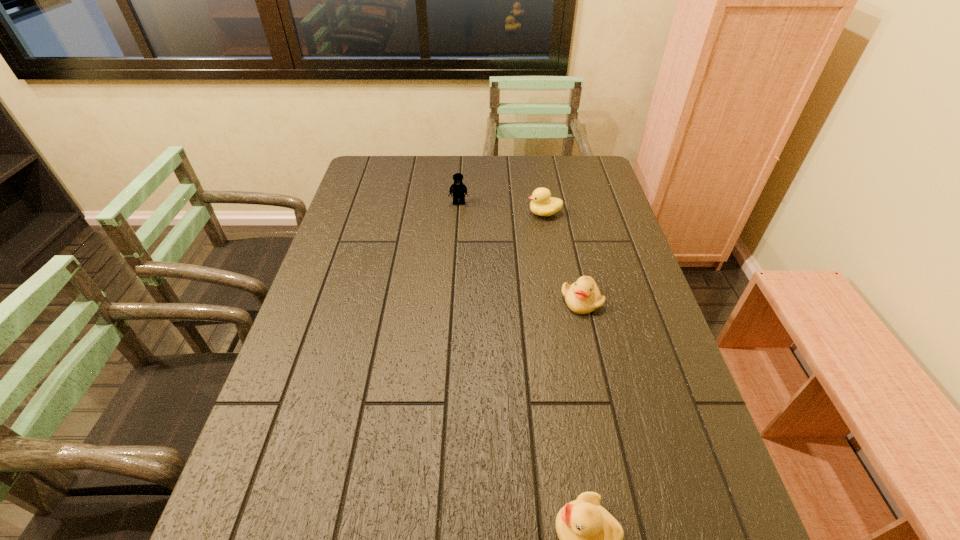
The image size is (960, 540). I want to click on the leftmost object, so click(x=458, y=189).

The image size is (960, 540). Identify the location of the farthest duckling. (542, 204).

Where is `the second nearest duckling`? This screenshot has width=960, height=540. the second nearest duckling is located at coordinates (582, 297).

This screenshot has height=540, width=960. I want to click on free region located 0.180m on the front-facing side of the Lego, so click(x=457, y=241).

This screenshot has height=540, width=960. I want to click on free space located 0.060m on the beak of the farthest duckling, so click(509, 213).

Locate an element on the screen. This screenshot has height=540, width=960. vacant region located 0.110m on the beak of the farthest duckling is located at coordinates (494, 213).

The height and width of the screenshot is (540, 960). I want to click on free spot located on the beak of the farthest duckling, so click(458, 213).

Locate an element on the screen. The image size is (960, 540). free region located 0.110m on the front-facing side of the second farthest duckling is located at coordinates (592, 350).

You are a GUI agent. You are given a task and a screenshot of the screen. Output one action in this format:
    pyautogui.click(x=<x>, y=<y>)
    Task: Click on the object present at the right edge
    This screenshot has width=960, height=540.
    Given the screenshot: What is the action you would take?
    pyautogui.click(x=582, y=297)

You are a GUI agent. You are given a task and a screenshot of the screen. Output one action in this format:
    pyautogui.click(x=<x>, y=<y>)
    Task: Click on the vacant space at the far edge
    
    Given the screenshot: What is the action you would take?
    pyautogui.click(x=526, y=182)